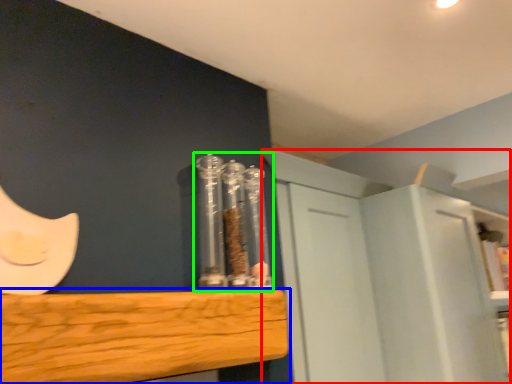
Question: Estimate the real-world distances between objects in this image. Which object is farther from cabinetry (highlighted by a red box), furniture (highlighted by a blue box) or glass jar (highlighted by a green box)?

Choices:
 (A) furniture
 (B) glass jar

Answer: (A)